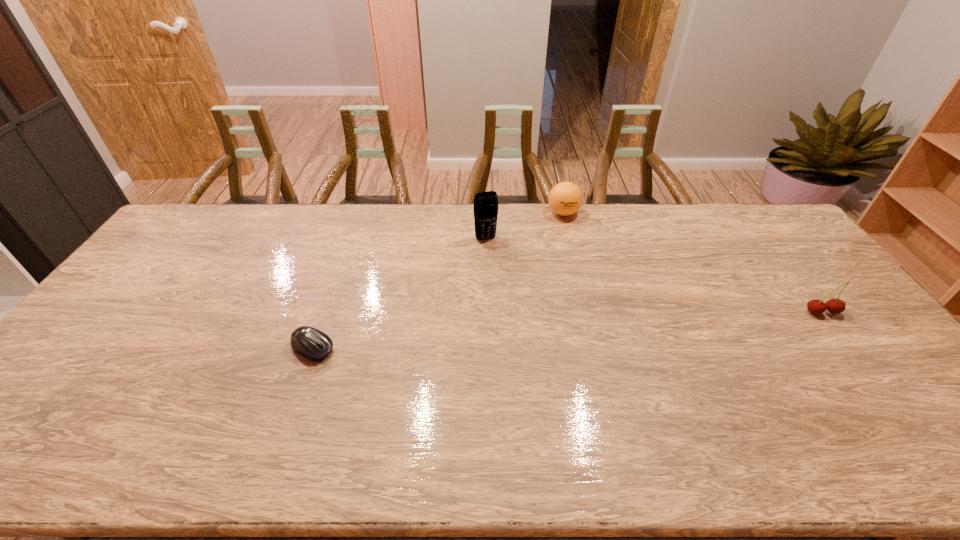
You are a GUI agent. You are given a task and a screenshot of the screen. Output one action in this format:
    pyautogui.click(x=<x>, y=<y>)
    Task: Click on the vacant space on the desktop that is between the nearest object and the third farthest object and is positioned on the side with brand of the third object from left to right
    This screenshot has height=540, width=960.
    Given the screenshot: What is the action you would take?
    pyautogui.click(x=530, y=333)

I want to click on vacant space on the desktop that is between the nearest object and the cherry and is positioned on the screen of the second object from left to right, so click(525, 333).